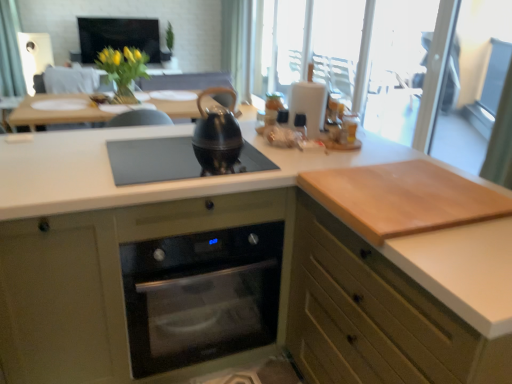
The image size is (512, 384). I want to click on matte black screen at upper center, so click(x=118, y=36).

What do you see at coordinates (154, 160) in the screenshot?
I see `black glass gas stove at center` at bounding box center [154, 160].

Describe the element at coordinates (201, 295) in the screenshot. I see `stainless steel oven at center` at that location.

Identify the location of matte black screen at upper center. The image size is (512, 384). (118, 36).

Looking at the image, does transparent glass screen door at upper right seem bigger or smaller compared to black matte kettle at center?

Clearly, transparent glass screen door at upper right is larger in size than black matte kettle at center.

From a real-world perspective, is transparent glass screen door at upper right physically below black matte kettle at center?

Yes, from a real-world perspective, transparent glass screen door at upper right is beneath black matte kettle at center.

Locate an element on the screen. This screenshot has height=384, width=512. kitchen appliance in front of the transparent glass screen door at upper right is located at coordinates (217, 135).

Which is more to the left, transparent glass screen door at upper right or black matte kettle at center?

From the viewer's perspective, black matte kettle at center appears more on the left side.

Based on the photo, is black glass gas stove at center with wooden cutting board at right, arranged as the 1th cabinetry when viewed from the right?

black glass gas stove at center and wooden cutting board at right, arranged as the 1th cabinetry when viewed from the right, are clearly separated.

Is black glass gas stove at center taller than wooden cutting board at right, placed as the second cabinetry when sorted from left to right?

No.

From the image's perspective, is black glass gas stove at center above or below wooden cutting board at right, arranged as the 1th cabinetry when viewed from the right?

A: Clearly, from the image's perspective, black glass gas stove at center is above wooden cutting board at right, arranged as the 1th cabinetry when viewed from the right.

Is black glass gas stove at center surrounding wooden cutting board at right, placed as the second cabinetry when sorted from left to right?

No, wooden cutting board at right, placed as the second cabinetry when sorted from left to right, is not inside black glass gas stove at center.

Is wooden cutting board at right, placed as the second cabinetry when sorted from left to right, positioned with its back to olive green wood oven at center, the 1th cabinetry when ordered from left to right?

No, wooden cutting board at right, placed as the second cabinetry when sorted from left to right, is not facing the opposite direction of olive green wood oven at center, the 1th cabinetry when ordered from left to right.

Can you confirm if wooden cutting board at right, placed as the second cabinetry when sorted from left to right, is thinner than olive green wood oven at center, which is the second cabinetry in right-to-left order?

Indeed, wooden cutting board at right, placed as the second cabinetry when sorted from left to right, has a lesser width compared to olive green wood oven at center, which is the second cabinetry in right-to-left order.

Can you confirm if black glass gas stove at center is positioned to the right of black matte kettle at center?

In fact, black glass gas stove at center is to the left of black matte kettle at center.

From the image's perspective, is black glass gas stove at center above black matte kettle at center?

No.

Which is closer to the camera, (121,162) or (242,141)?

Point (121,162).

The width and height of the screenshot is (512, 384). Find the location of `gas stove on the left side of black matte kettle at center`. gas stove on the left side of black matte kettle at center is located at coordinates (154, 160).

How different are the orientations of stainless steel oven at center and black matte kettle at center in degrees?

They differ by 1.48 degrees in their facing directions.

Based on their positions, is stainless steel oven at center located to the left or right of black matte kettle at center?

In the image, stainless steel oven at center appears on the left side of black matte kettle at center.

Is stainless steel oven at center in front of or behind black matte kettle at center in the image?

Clearly, stainless steel oven at center is in front of black matte kettle at center.

Does black matte kettle at center have a lesser width compared to black glass gas stove at center?

Yes, black matte kettle at center is thinner than black glass gas stove at center.

How far apart are black matte kettle at center and black glass gas stove at center?

black matte kettle at center and black glass gas stove at center are 5.30 inches apart.

Is black glass gas stove at center a part of black matte kettle at center?

No, black glass gas stove at center is not a part of black matte kettle at center.

From a real-world perspective, which object stands above the other?

In real-world perspective, black matte kettle at center is above.

Is olive green wood oven at center, the 1th cabinetry when ordered from left to right, oriented away from transparent glass screen door at upper right?

olive green wood oven at center, the 1th cabinetry when ordered from left to right, does not have its back to transparent glass screen door at upper right.

From the image's perspective, is olive green wood oven at center, the 1th cabinetry when ordered from left to right, below transparent glass screen door at upper right?

Yes, from the image's perspective, olive green wood oven at center, the 1th cabinetry when ordered from left to right, is below transparent glass screen door at upper right.

How different are the orientations of olive green wood oven at center, the 1th cabinetry when ordered from left to right, and transparent glass screen door at upper right in degrees?

89.1 degrees.

At what (x,y) coordinates should I click in order to perform the action: click on the 2nd cabinetry counting from the left of the transparent glass screen door at upper right. Please return your answer as a coordinate pair (x, y). The width and height of the screenshot is (512, 384). Looking at the image, I should click on (101, 281).

Where is `kitchen appliance that is on the left side of transparent glass screen door at upper right`? This screenshot has width=512, height=384. kitchen appliance that is on the left side of transparent glass screen door at upper right is located at coordinates 217,135.

Where is `gas stove above the wooden cutting board at right, arranged as the 1th cabinetry when viewed from the right (from a real-world perspective)`? This screenshot has height=384, width=512. gas stove above the wooden cutting board at right, arranged as the 1th cabinetry when viewed from the right (from a real-world perspective) is located at coordinates click(x=154, y=160).

Consider the image. When comparing their distances from light brown wood cutting board at right, does stainless steel oven at center or olive green wood oven at center, which is the second cabinetry in right-to-left order, seem further?

Among the two, olive green wood oven at center, which is the second cabinetry in right-to-left order, is located further to light brown wood cutting board at right.

In the scene shown: Which object lies nearer to the anchor point olive green wood oven at center, which is the second cabinetry in right-to-left order, transparent glass screen door at upper right or black matte kettle at center?

black matte kettle at center lies closer to olive green wood oven at center, which is the second cabinetry in right-to-left order, than the other object.

Considering their positions, is black glass gas stove at center positioned further to black matte kettle at center than light brown wood cutting board at right?

light brown wood cutting board at right is further to black matte kettle at center.

Based on their spatial positions, is black glass gas stove at center or matte black screen at upper center further from wooden cutting board at right, placed as the second cabinetry when sorted from left to right?

Among the two, matte black screen at upper center is located further to wooden cutting board at right, placed as the second cabinetry when sorted from left to right.

When comparing their distances from transparent glass screen door at upper right, does light brown wood cutting board at right or olive green wood oven at center, the 1th cabinetry when ordered from left to right, seem further?

olive green wood oven at center, the 1th cabinetry when ordered from left to right.

Estimate the real-world distances between objects in this image. Which object is closer to olive green wood oven at center, which is the second cabinetry in right-to-left order, black glass gas stove at center or transparent glass screen door at upper right?

black glass gas stove at center is closer to olive green wood oven at center, which is the second cabinetry in right-to-left order.

When comparing their distances from black matte kettle at center, does olive green wood oven at center, the 1th cabinetry when ordered from left to right, or matte black screen at upper center seem further?

Based on the image, matte black screen at upper center appears to be further to black matte kettle at center.

When comparing their distances from matte black screen at upper center, does black glass gas stove at center or wooden cutting board at right, placed as the second cabinetry when sorted from left to right, seem closer?

Based on the image, black glass gas stove at center appears to be nearer to matte black screen at upper center.

The height and width of the screenshot is (384, 512). In order to click on cabinetry located between black glass gas stove at center and light brown wood cutting board at right in the left-right direction in this screenshot , I will do `click(375, 316)`.

Where is `gas stove between olive green wood oven at center, which is the second cabinetry in right-to-left order, and wooden cutting board at right, placed as the second cabinetry when sorted from left to right`? gas stove between olive green wood oven at center, which is the second cabinetry in right-to-left order, and wooden cutting board at right, placed as the second cabinetry when sorted from left to right is located at coordinates (154, 160).

This screenshot has height=384, width=512. What are the coordinates of `gas stove between stainless steel oven at center and wooden cutting board at right, arranged as the 1th cabinetry when viewed from the right, from left to right` in the screenshot? It's located at (154, 160).

The width and height of the screenshot is (512, 384). Find the location of `screen door between stainless steel oven at center and matte black screen at upper center in the front-back direction`. screen door between stainless steel oven at center and matte black screen at upper center in the front-back direction is located at coordinates (474, 83).